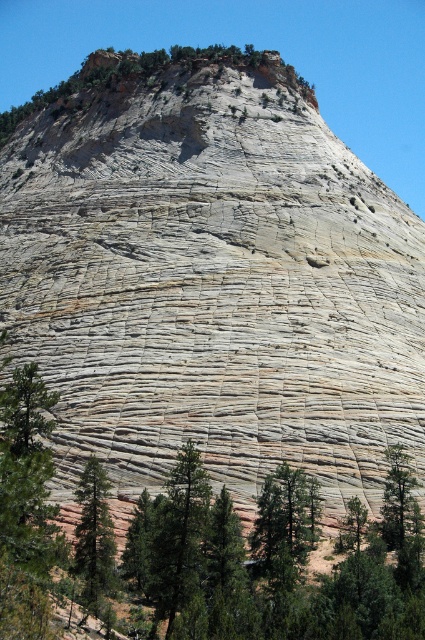
Does point (87, 564) come farther from viewer compared to point (405, 488)?

No, it is in front of (405, 488).

Measure the distance between green matte tree at lower left and camera.

green matte tree at lower left and camera are 47.87 meters apart.

The width and height of the screenshot is (425, 640). What do you see at coordinates (93, 538) in the screenshot?
I see `green matte tree at lower left` at bounding box center [93, 538].

Find the location of a particular element. green matte tree at lower left is located at coordinates (93, 538).